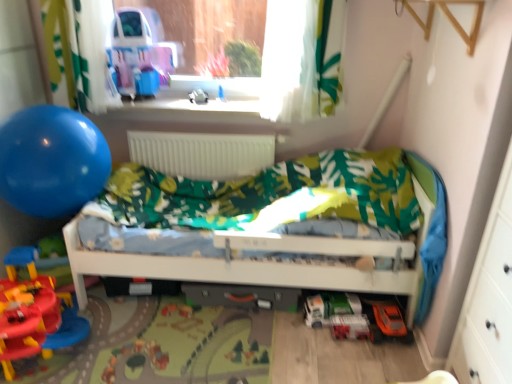
Question: Does green matte toy car at lower center, the 3th toy ordered from the bottom, have a lesser width compared to white matte radiator at center?

Choices:
 (A) yes
 (B) no

Answer: (B)

Question: Is green matte toy car at lower center, marked as the 3th toy in a top-to-bottom arrangement, oriented away from white matte radiator at center?

Choices:
 (A) yes
 (B) no

Answer: (B)

Question: Is green matte toy car at lower center, marked as the 3th toy in a top-to-bottom arrangement, next to white matte radiator at center and touching it?

Choices:
 (A) no
 (B) yes

Answer: (A)

Question: From the image's perspective, is green matte toy car at lower center, which is counted as the 3th toy, starting from the left, on white matte radiator at center?

Choices:
 (A) yes
 (B) no

Answer: (B)

Question: Considering the relative sizes of green matte toy car at lower center, which is counted as the 2th toy, starting from the back, and white matte radiator at center in the image provided, is green matte toy car at lower center, which is counted as the 2th toy, starting from the back, bigger than white matte radiator at center?

Choices:
 (A) yes
 (B) no

Answer: (B)

Question: Is green matte toy car at lower center, the 3th toy ordered from the bottom, smaller than white matte radiator at center?

Choices:
 (A) yes
 (B) no

Answer: (A)

Question: Can you confirm if white plastic toy at center, the 1th toy positioned from the top, is wider than clear plastic window sill at upper center?

Choices:
 (A) yes
 (B) no

Answer: (B)

Question: Is white plastic toy at center, which ranks as the 1th toy in back-to-front order, at the right side of clear plastic window sill at upper center?

Choices:
 (A) yes
 (B) no

Answer: (B)

Question: Does white plastic toy at center, arranged as the second toy when viewed from the left, have a larger size compared to clear plastic window sill at upper center?

Choices:
 (A) yes
 (B) no

Answer: (B)

Question: From the image's perspective, is white plastic toy at center, which is counted as the 4th toy, starting from the right, under clear plastic window sill at upper center?

Choices:
 (A) no
 (B) yes

Answer: (A)

Question: From a real-world perspective, is white plastic toy at center, arranged as the second toy when viewed from the left, located higher than clear plastic window sill at upper center?

Choices:
 (A) yes
 (B) no

Answer: (A)

Question: Can you confirm if white plastic toy at center, the 1th toy positioned from the top, is thinner than clear plastic window sill at upper center?

Choices:
 (A) no
 (B) yes

Answer: (B)

Question: Does green matte toy car at lower center, the 4th toy in the front-to-back sequence, have a greater width compared to rubberized plastic playset at lower left, which is the 5th toy from right to left?

Choices:
 (A) no
 (B) yes

Answer: (A)